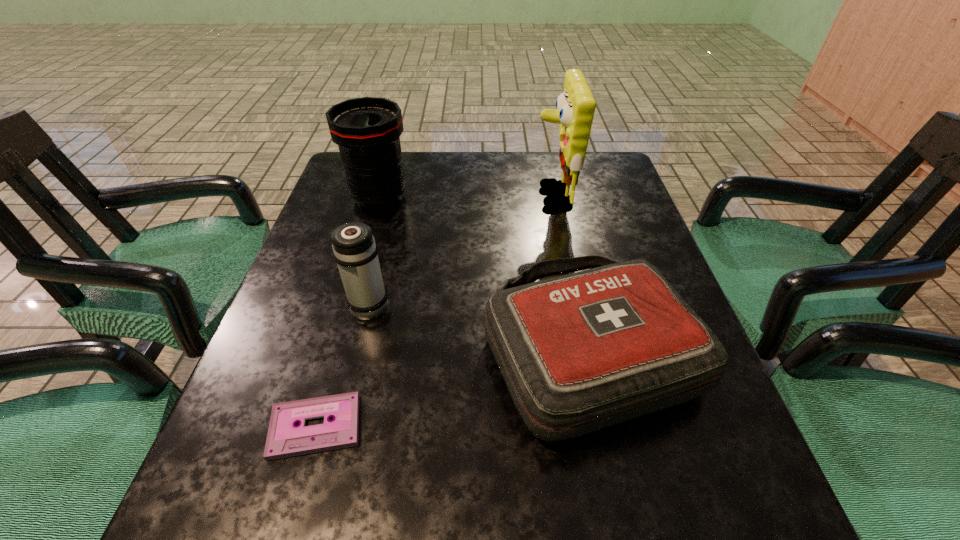
Identify the location of the tallest object. (575, 106).

The image size is (960, 540). I want to click on the fourth shortest object, so click(367, 130).

The image size is (960, 540). What are the coordinates of `thermos bottle` in the screenshot? It's located at (354, 249).

Find the location of `the first-aid kit`. the first-aid kit is located at coordinates (580, 352).

The width and height of the screenshot is (960, 540). Identify the location of the shortest object. tap(285, 439).

Where is `vacant space located on the face of the sponge`? vacant space located on the face of the sponge is located at coordinates (461, 197).

Locate an element on the screen. The image size is (960, 540). free spot located 0.100m on the face of the sponge is located at coordinates (494, 197).

At what (x,y) coordinates should I click in order to perform the action: click on free space located 0.320m on the face of the sponge. Please return your answer as a coordinate pair (x, y). The width and height of the screenshot is (960, 540). Looking at the image, I should click on (411, 197).

Image resolution: width=960 pixels, height=540 pixels. What are the coordinates of `free spot located 0.330m on the front of the second tallest object` in the screenshot? It's located at (345, 317).

Find the location of a particular element. vacant space located 0.340m on the side with the handle of the third shortest object is located at coordinates (396, 195).